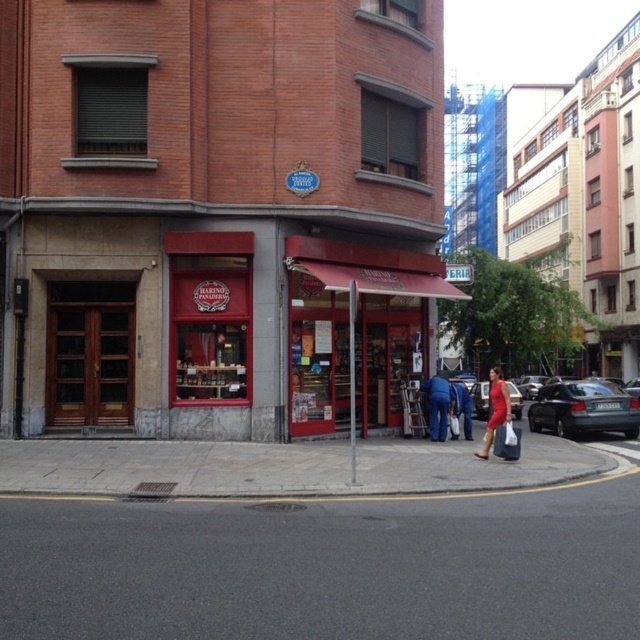
Question: Which object appears farthest from the camera in this image?

Choices:
 (A) dark gray metallic car at right
 (B) blue jeans at lower center

Answer: (A)

Question: Is gray concrete pavement at lower center bigger than metallic silver car at center?

Choices:
 (A) no
 (B) yes

Answer: (A)

Question: Which object appears farthest from the camera in this image?

Choices:
 (A) red matte awning at center
 (B) matte red dress at center

Answer: (A)

Question: Is dark gray metallic car at right to the left of blue denim pants at lower center from the viewer's perspective?

Choices:
 (A) yes
 (B) no

Answer: (B)

Question: Which point is farther to the camera?

Choices:
 (A) (595, 403)
 (B) (339, 212)
 (C) (490, 387)
 (D) (497, 420)

Answer: (C)

Question: Is blue denim pants at lower center smaller than blue jeans at lower center?

Choices:
 (A) yes
 (B) no

Answer: (B)